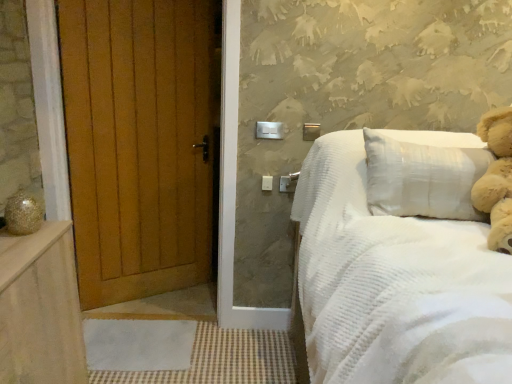
Question: Is wooden door at left thinner than fluffy beige teddy bear at upper right?

Choices:
 (A) no
 (B) yes

Answer: (B)

Question: Is wooden door at left further to camera compared to fluffy beige teddy bear at upper right?

Choices:
 (A) no
 (B) yes

Answer: (B)

Question: Considering the relative positions of wooden door at left and fluffy beige teddy bear at upper right in the image provided, is wooden door at left to the right of fluffy beige teddy bear at upper right from the viewer's perspective?

Choices:
 (A) yes
 (B) no

Answer: (B)

Question: Would you consider wooden door at left to be distant from fluffy beige teddy bear at upper right?

Choices:
 (A) no
 (B) yes

Answer: (B)

Question: Is wooden door at left in contact with fluffy beige teddy bear at upper right?

Choices:
 (A) no
 (B) yes

Answer: (A)

Question: From the image's perspective, would you say wooden door at left is shown under fluffy beige teddy bear at upper right?

Choices:
 (A) yes
 (B) no

Answer: (A)

Question: Is fluffy beige teddy bear at upper right next to wooden balustrade at lower left and touching it?

Choices:
 (A) yes
 (B) no

Answer: (B)

Question: Is there a large distance between fluffy beige teddy bear at upper right and wooden balustrade at lower left?

Choices:
 (A) yes
 (B) no

Answer: (A)

Question: Is wooden balustrade at lower left a part of fluffy beige teddy bear at upper right?

Choices:
 (A) no
 (B) yes

Answer: (A)

Question: From a real-world perspective, is fluffy beige teddy bear at upper right on top of wooden balustrade at lower left?

Choices:
 (A) yes
 (B) no

Answer: (A)

Question: Is the position of fluffy beige teddy bear at upper right more distant than that of wooden balustrade at lower left?

Choices:
 (A) yes
 (B) no

Answer: (A)

Question: Considering the relative sizes of fluffy beige teddy bear at upper right and wooden balustrade at lower left in the image provided, is fluffy beige teddy bear at upper right smaller than wooden balustrade at lower left?

Choices:
 (A) no
 (B) yes

Answer: (B)

Question: Can you confirm if fluffy beige teddy bear at upper right is positioned to the right of wooden door at left?

Choices:
 (A) yes
 (B) no

Answer: (A)